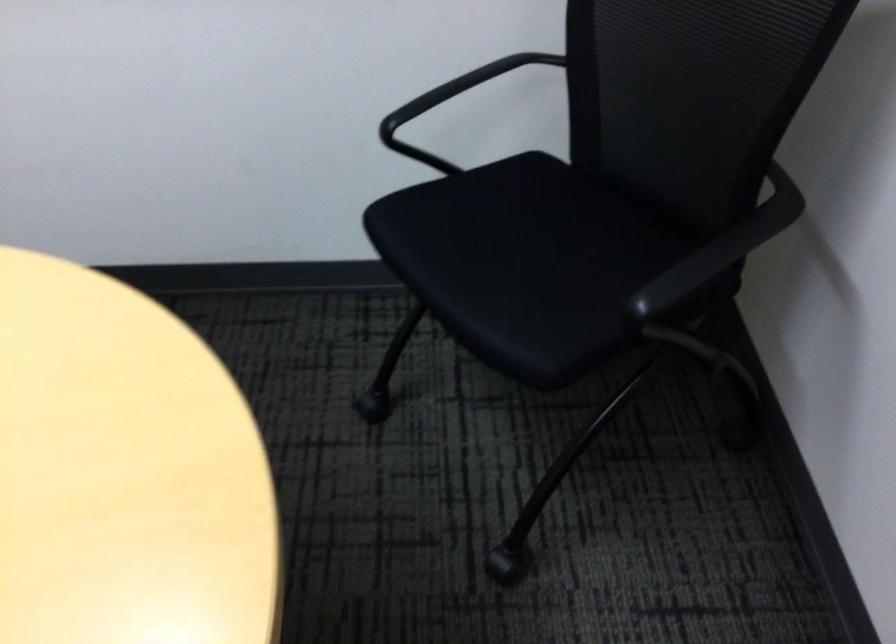
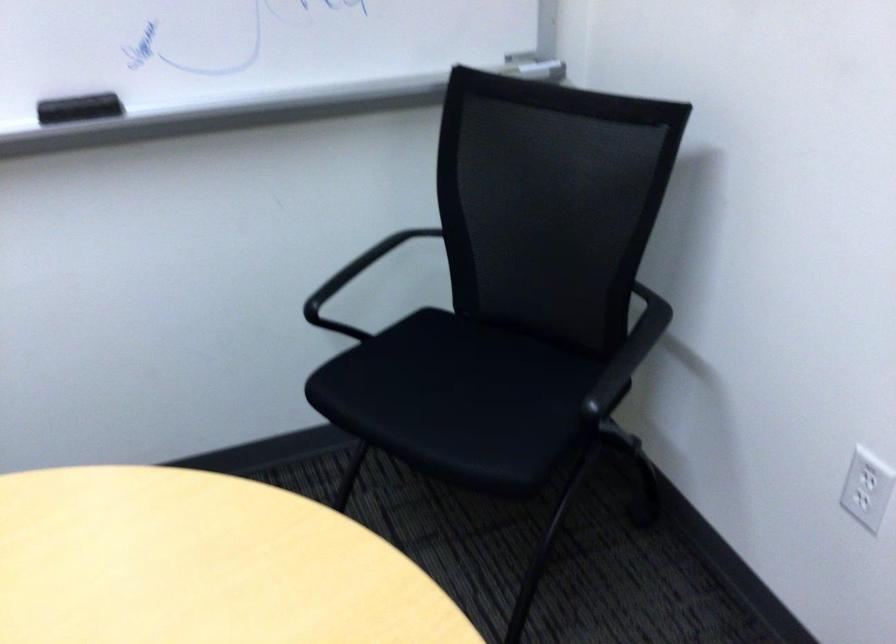
Locate, in the second image, the point that corresponds to point (812, 321) in the first image.

(673, 399)